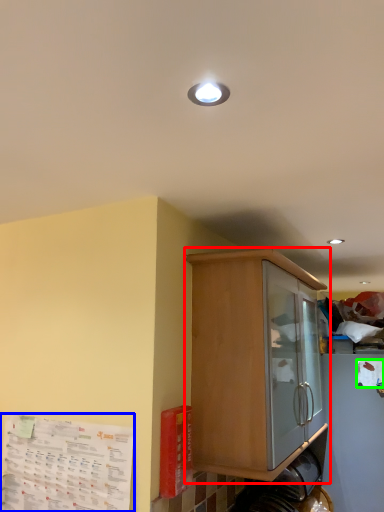
Question: Considering the real-world distances, which object is closest to cabinetry (highlighted by a red box)? paper (highlighted by a blue box) or paper (highlighted by a green box).

Choices:
 (A) paper
 (B) paper

Answer: (A)